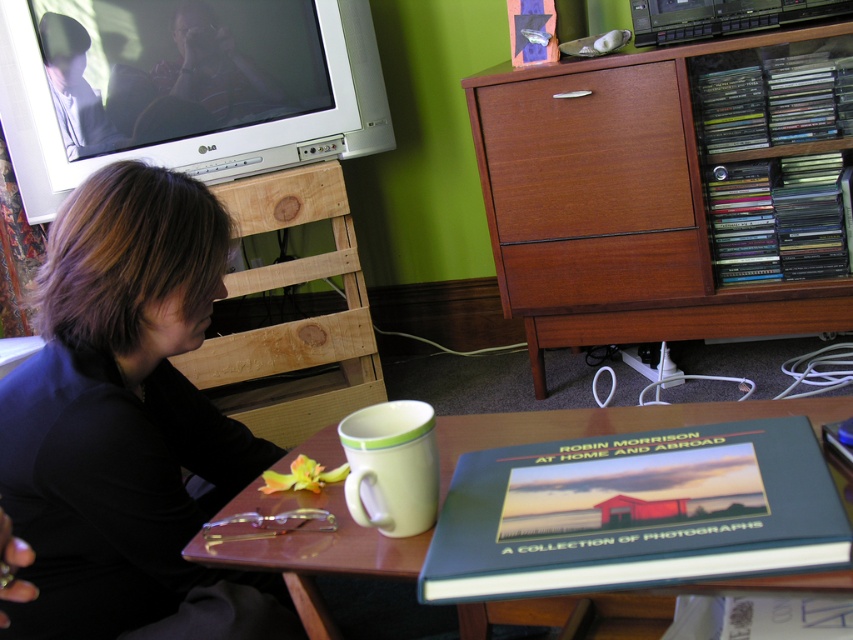
Can you confirm if wooden cabinet at upper right is positioned below wooden table at lower center?

Actually, wooden cabinet at upper right is above wooden table at lower center.

Looking at this image, is wooden cabinet at upper right thinner than wooden table at lower center?

No.

Who is more forward, (698, 48) or (552, 618)?

Positioned in front is point (552, 618).

Locate an element on the screen. This screenshot has width=853, height=640. wooden cabinet at upper right is located at coordinates (618, 204).

Does point (51, 579) lie behind point (306, 586)?

Yes, point (51, 579) is farther from viewer.

Can you confirm if black fabric shirt at left is positioned below wooden table at lower center?

No, black fabric shirt at left is not below wooden table at lower center.

What do you see at coordinates (128, 424) in the screenshot? This screenshot has height=640, width=853. I see `black fabric shirt at left` at bounding box center [128, 424].

Where is `black fabric shirt at left`? The image size is (853, 640). black fabric shirt at left is located at coordinates (128, 424).

Is black fabric shirt at left further to the viewer compared to wooden cabinet at upper right?

No, black fabric shirt at left is in front of wooden cabinet at upper right.

Does black fabric shirt at left have a lesser width compared to wooden cabinet at upper right?

Indeed, black fabric shirt at left has a lesser width compared to wooden cabinet at upper right.

I want to click on black fabric shirt at left, so click(x=128, y=424).

The image size is (853, 640). I want to click on black fabric shirt at left, so click(128, 424).